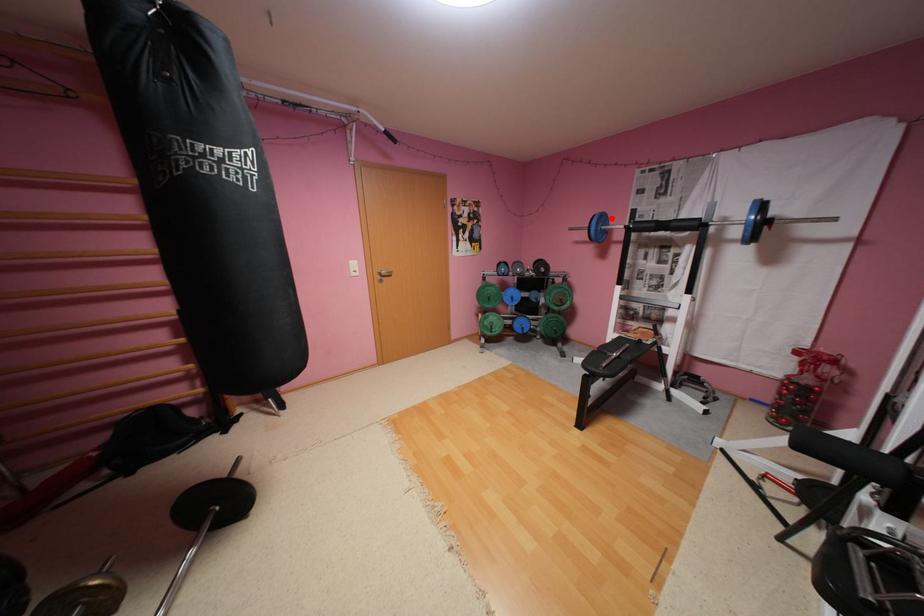
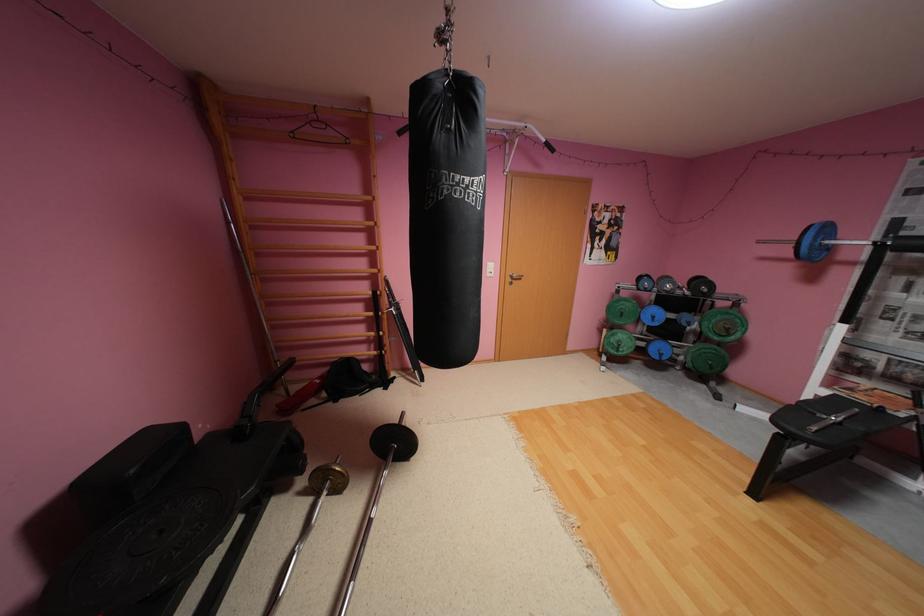
Question: I am providing you with two images of the same scene from different viewpoints. Given a red point in image1, look at the same physical point in image2. Is it:

Choices:
 (A) Closer to the viewpoint
 (B) Farther from the viewpoint

Answer: (B)